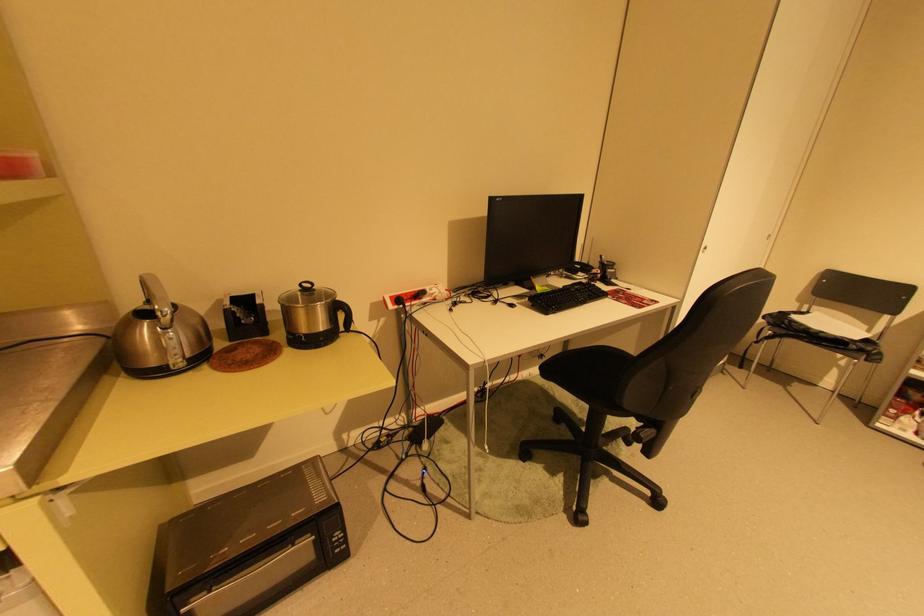
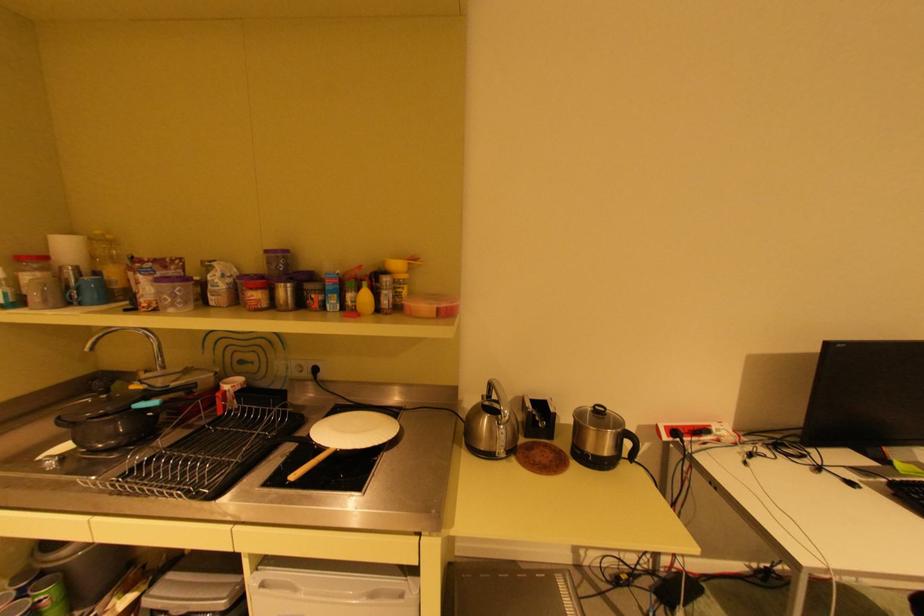
The point at (x=309, y=285) is marked in the first image. Where is the corresponding point in the second image?

(602, 407)